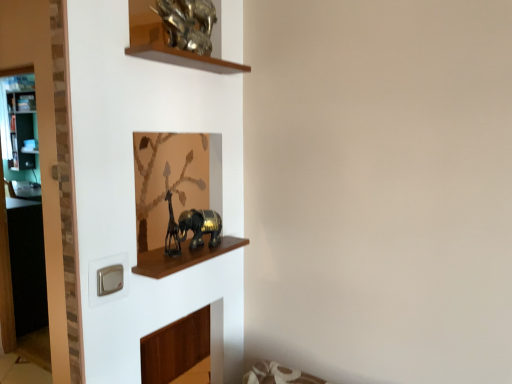
Question: From a real-world perspective, is gold metallic elephant at center, acting as the 1th animal starting from the bottom, positioned under transparent glass door at left based on gravity?

Choices:
 (A) no
 (B) yes

Answer: (A)

Question: Is there a large distance between gold metallic elephant at center, acting as the 1th animal starting from the bottom, and transparent glass door at left?

Choices:
 (A) yes
 (B) no

Answer: (A)

Question: Does gold metallic elephant at center, the second animal positioned from the top, have a smaller size compared to transparent glass door at left?

Choices:
 (A) no
 (B) yes

Answer: (B)

Question: Is gold metallic elephant at center, acting as the 1th animal starting from the bottom, to the right of transparent glass door at left from the viewer's perspective?

Choices:
 (A) no
 (B) yes

Answer: (B)

Question: Considering the relative sizes of gold metallic elephant at center, acting as the 1th animal starting from the bottom, and transparent glass door at left in the image provided, is gold metallic elephant at center, acting as the 1th animal starting from the bottom, wider than transparent glass door at left?

Choices:
 (A) yes
 (B) no

Answer: (B)

Question: From a real-world perspective, is transparent glass door at left positioned above or below gold metallic elephant at center, the second animal positioned from the top?

Choices:
 (A) above
 (B) below

Answer: (B)

Question: Do you think transparent glass door at left is within gold metallic elephant at center, acting as the 1th animal starting from the bottom, or outside of it?

Choices:
 (A) outside
 (B) inside

Answer: (A)

Question: In the image, is transparent glass door at left on the left side or the right side of gold metallic elephant at center, acting as the 1th animal starting from the bottom?

Choices:
 (A) right
 (B) left

Answer: (B)

Question: In terms of width, does transparent glass door at left look wider or thinner when compared to gold metallic elephant at center, acting as the 1th animal starting from the bottom?

Choices:
 (A) thin
 (B) wide

Answer: (B)

Question: Is gold metallic elephant at center, the second animal positioned from the top, inside the boundaries of gold metallic sculpture at upper center, which is the second animal in bottom-to-top order, or outside?

Choices:
 (A) outside
 (B) inside

Answer: (A)

Question: Is gold metallic elephant at center, acting as the 1th animal starting from the bottom, in front of or behind gold metallic sculpture at upper center, which is the second animal in bottom-to-top order, in the image?

Choices:
 (A) behind
 (B) front

Answer: (A)

Question: Based on their positions, is gold metallic elephant at center, acting as the 1th animal starting from the bottom, located to the left or right of gold metallic sculpture at upper center, which ranks as the 1th animal in top-to-bottom order?

Choices:
 (A) right
 (B) left

Answer: (A)

Question: Looking at the image, does gold metallic elephant at center, acting as the 1th animal starting from the bottom, seem bigger or smaller compared to gold metallic sculpture at upper center, which is the second animal in bottom-to-top order?

Choices:
 (A) small
 (B) big

Answer: (A)

Question: In the image, is gold metallic elephant at center, acting as the 1th animal starting from the bottom, positioned in front of or behind transparent glass door at left?

Choices:
 (A) behind
 (B) front

Answer: (B)

Question: From the image's perspective, relative to transparent glass door at left, is gold metallic elephant at center, acting as the 1th animal starting from the bottom, above or below?

Choices:
 (A) above
 (B) below

Answer: (A)